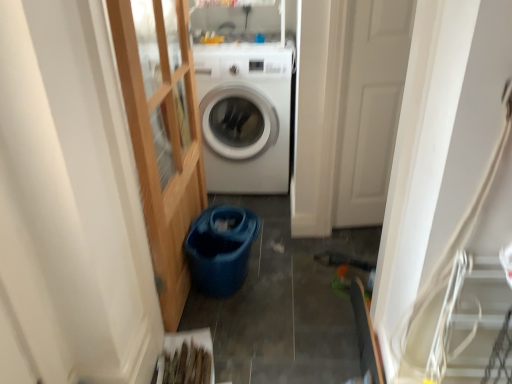
Locate an element on the screen. The image size is (512, 384). white glossy washing machine at center is located at coordinates (245, 115).

Describe the element at coordinates (245, 115) in the screenshot. The width and height of the screenshot is (512, 384). I see `white glossy washing machine at center` at that location.

Image resolution: width=512 pixels, height=384 pixels. In order to click on white glossy washing machine at center in this screenshot , I will do `click(245, 115)`.

Can you confirm if white matte door at center is taller than white glossy washing machine at center?

Yes, white matte door at center is taller than white glossy washing machine at center.

Is point (384, 29) less distant than point (277, 130)?

Yes, it is in front of point (277, 130).

From the image's perspective, which one is positioned lower, white matte door at center or white glossy washing machine at center?

white matte door at center, from the image's perspective.

From a real-world perspective, which object stands above the other?

white matte door at center, from a real-world perspective.

From the picture: In terms of height, does white glossy washing machine at center look taller or shorter compared to white matte door at center?

Clearly, white glossy washing machine at center is shorter compared to white matte door at center.

Can you confirm if white glossy washing machine at center is smaller than white matte door at center?

No.

Looking at this image, from a real-world perspective, relative to white matte door at center, is white glossy washing machine at center vertically above or below?

white glossy washing machine at center is situated lower than white matte door at center in the real world.

Which of these two, clear glass door at left or white glossy washing machine at center, is smaller?

With smaller size is clear glass door at left.

Which object is closer to the camera taking this photo, clear glass door at left or white glossy washing machine at center?

clear glass door at left is in front.

Looking at this image, who is taller, white glossy washing machine at center or clear glass door at left?

Result: clear glass door at left is taller.

Measure the distance from white glossy washing machine at center to clear glass door at left.

white glossy washing machine at center and clear glass door at left are 21.37 inches apart from each other.

In the scene shown: How many degrees apart are the facing directions of white glossy washing machine at center and clear glass door at left?

89 degrees separate the facing orientations of white glossy washing machine at center and clear glass door at left.

Consider the image. Does white glossy washing machine at center appear on the left side of clear glass door at left?

No.

From a real-world perspective, is clear glass door at left located higher than white matte door at center?

Yes, from a real-world perspective, clear glass door at left is on top of white matte door at center.

Which of these two, clear glass door at left or white matte door at center, is smaller?

white matte door at center.

At what (x,y) coordinates should I click in order to perform the action: click on glass door on the left of white matte door at center. Please return your answer as a coordinate pair (x, y). Looking at the image, I should click on (163, 146).

Between white matte door at center and clear glass door at left, which one appears on the right side from the viewer's perspective?

From the viewer's perspective, white matte door at center appears more on the right side.

Considering the sizes of white matte door at center and clear glass door at left in the image, is white matte door at center taller or shorter than clear glass door at left?

Considering their sizes, white matte door at center has less height than clear glass door at left.

From the image's perspective, is white matte door at center beneath clear glass door at left?

Incorrect, from the image's perspective, white matte door at center is higher than clear glass door at left.

From a real-world perspective, is white matte door at center beneath clear glass door at left?

Correct, in the physical world, white matte door at center is lower than clear glass door at left.

Find the location of `washing machine lying above the white matte door at center (from the image's perspective)`. washing machine lying above the white matte door at center (from the image's perspective) is located at coordinates (245, 115).

I want to click on washing machine located underneath the white matte door at center (from a real-world perspective), so click(x=245, y=115).

When comparing their distances from white glossy washing machine at center, does white matte door at center or clear glass door at left seem closer?

clear glass door at left lies closer to white glossy washing machine at center than the other object.

Looking at the image, which one is located further to clear glass door at left, white matte door at center or white glossy washing machine at center?

Based on the image, white matte door at center appears to be further to clear glass door at left.

From the image, which object appears to be nearer to white matte door at center, white glossy washing machine at center or clear glass door at left?

white glossy washing machine at center.

Considering their positions, is clear glass door at left positioned closer to white matte door at center than white glossy washing machine at center?

Among the two, white glossy washing machine at center is located nearer to white matte door at center.

Based on their spatial positions, is clear glass door at left or white matte door at center further from white glossy washing machine at center?

The object further to white glossy washing machine at center is white matte door at center.

Estimate the real-world distances between objects in this image. Which object is further from clear glass door at left, white glossy washing machine at center or white matte door at center?

Based on the image, white matte door at center appears to be further to clear glass door at left.

Where is `screen door between clear glass door at left and white glossy washing machine at center along the z-axis`? This screenshot has height=384, width=512. screen door between clear glass door at left and white glossy washing machine at center along the z-axis is located at coordinates (370, 107).